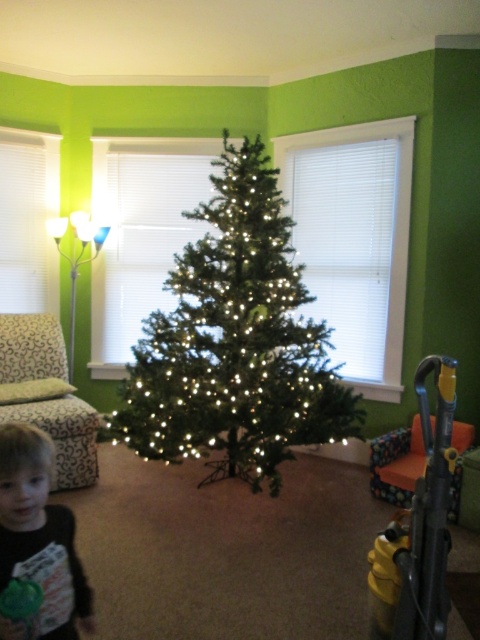
Does point (224, 218) come behind point (35, 616)?

Yes, point (224, 218) is behind point (35, 616).

What do you see at coordinates (236, 342) in the screenshot? I see `green matte christmas tree at center` at bounding box center [236, 342].

Locate an element on the screen. The width and height of the screenshot is (480, 640). green matte christmas tree at center is located at coordinates (236, 342).